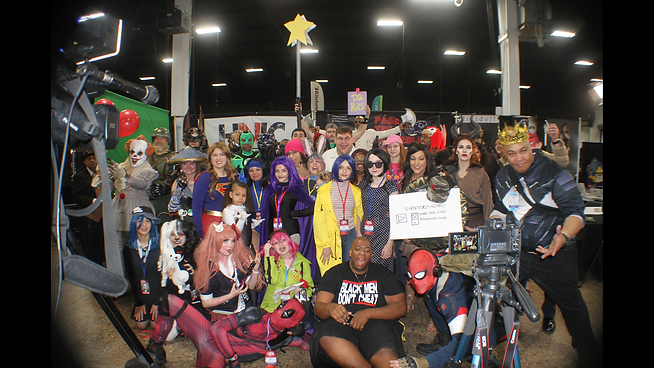
Where is `bracket`? This screenshot has width=654, height=368. bracket is located at coordinates (89, 269).